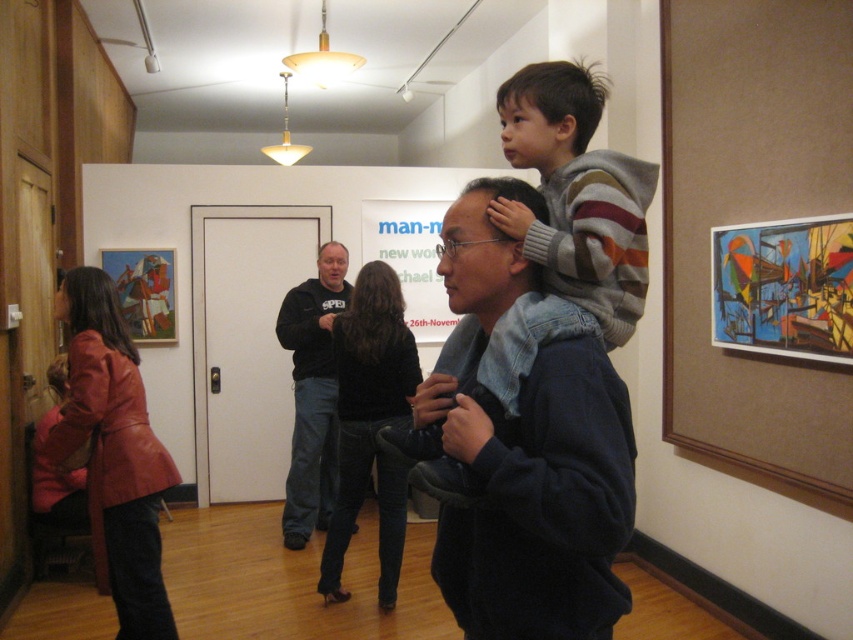
You are an art curator planning to hang a new painting between the striped sweater at center and the black leather jacket at center. Since the painting needs to be placed at a height where both can see it comfortably, which object should the painting be closer to?

The painting should be closer to the black leather jacket at center because the striped sweater at center has a lesser height and thus the painting needs to be placed lower for the striped sweater at center to see it comfortably, while the taller black leather jacket at center can see it from a higher position.

You are a security guard in the gallery and need to move a 1.2 meter wide painting to the space between the leather jacket at lower left and the black leather jacket at center. Is there enough space for the painting?

The distance between the leather jacket at lower left and the black leather jacket at center is 1.06 meters, which is less than the 1.2 meter width of the painting. Therefore, there is not enough space to place the painting between them.

You are an art gallery curator trying to arrange two jackets displayed on a mannequin stand. You have a black leather jacket at center and a black soft jacket at center. Which jacket should you place on the taller mannequin stand to match their actual sizes?

The black soft jacket at center should be placed on the taller mannequin stand because the black leather jacket at center has a lesser height compared to it.